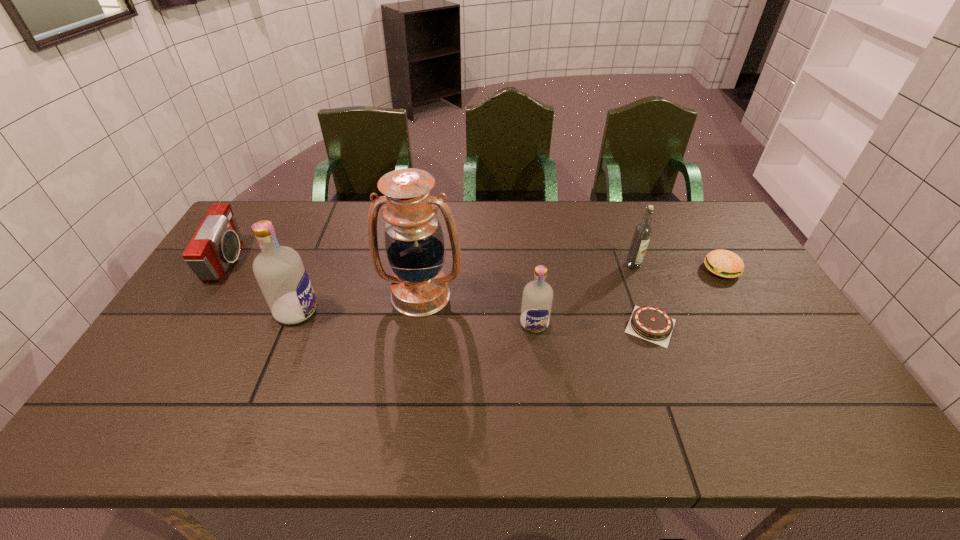
All vodkas are currently evenly spaced. To continue this pattern, where would you add another vodka on the right? Please point out a vacant spot. Please provide its 2D coordinates. Your answer should be formatted as a tuple, i.e. [(x, y)], where the tuple contains the x and y coordinates of a point satisfying the conditions above.

[(786, 336)]